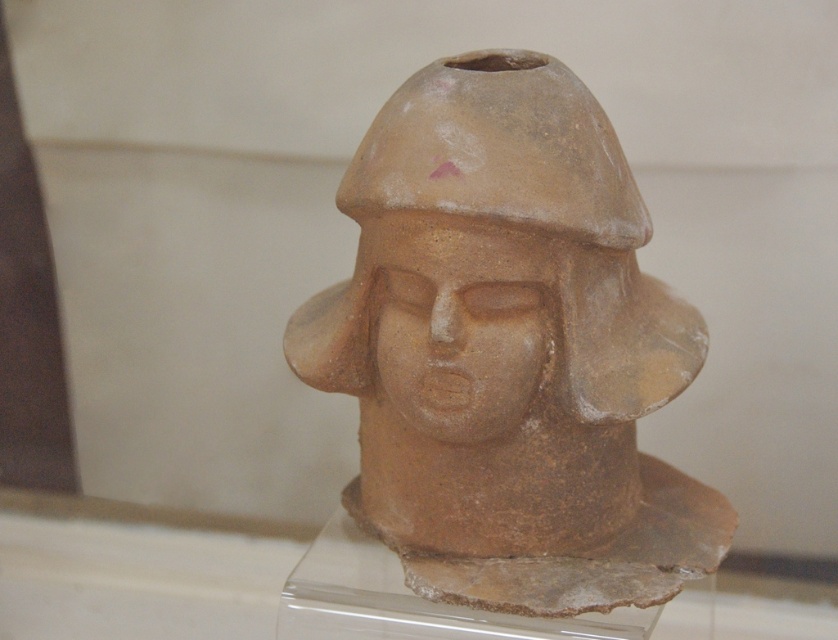
You are a photographer standing 1.09 meters away from the matte clay bust at center. Your camera has a focal length of 50mm. To capture the entire bust in the frame, you need to adjust your distance. Should you move closer or farther away?

The matte clay bust at center and camera are 1.09 meters apart. To capture the entire bust in the frame, you should move farther away from the matte clay bust at center because the current distance may be too close for the focal length to capture the whole subject.

You are an archaeologist examining an ancient sculpture. You notice two parts of the sculpture labeled as the matte clay bust at center and the matte clay face at center. Based on their positions, which part is located below the other?

The matte clay bust at center is positioned under the matte clay face at center, meaning the bust is below the face.